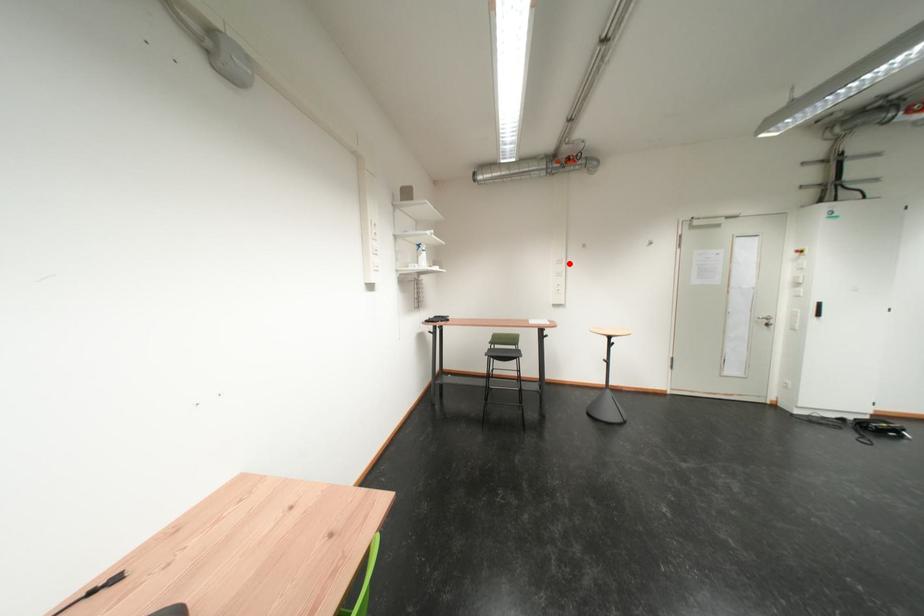
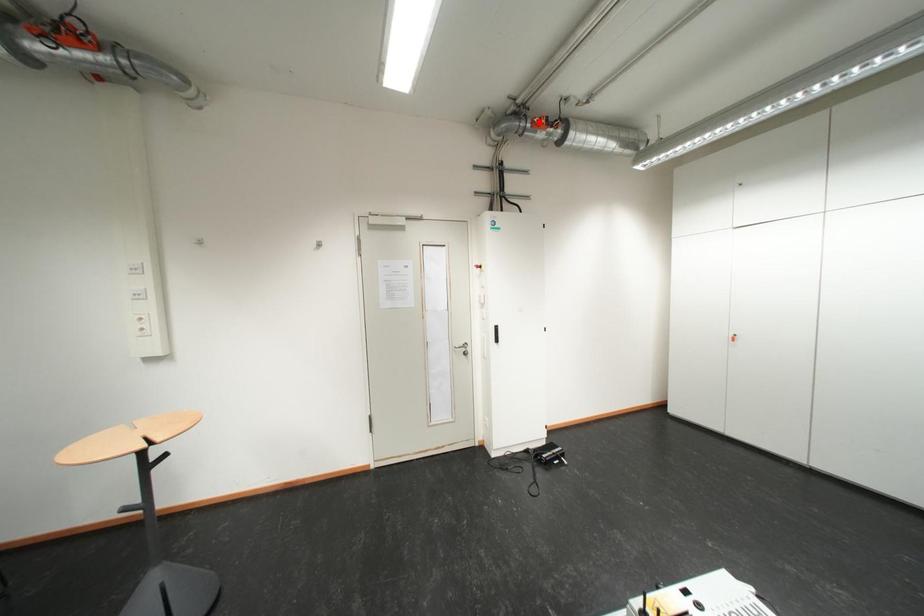
I am providing you with two images of the same scene from different viewpoints. A red point is marked on the first image and another point is marked on the second image. Is the marked point in image1 the same physical position as the marked point in image2?

No